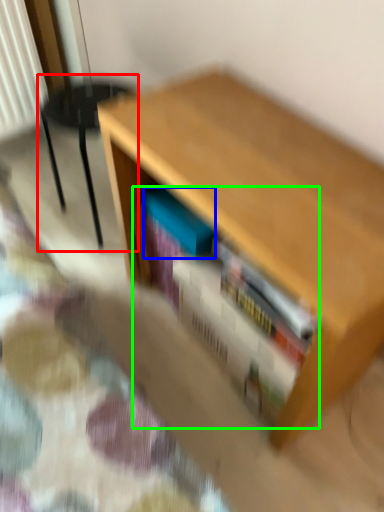
Question: Based on their relative distances, which object is farther from armchair (highlighted by a red box)? Choose from paperback book (highlighted by a blue box) and book (highlighted by a green box).

Choices:
 (A) paperback book
 (B) book

Answer: (B)